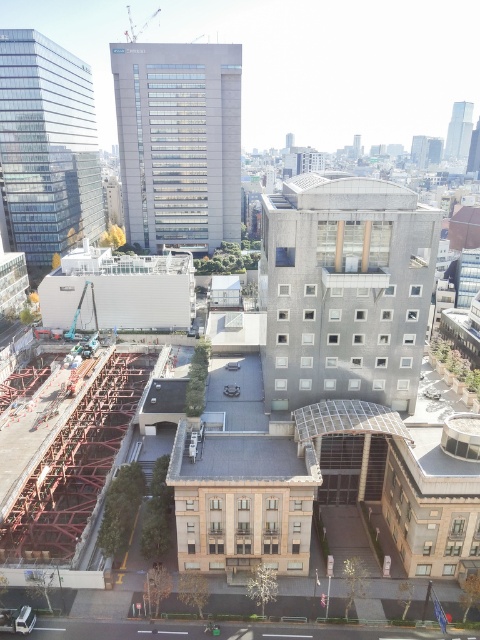
Question: Can you confirm if slate gray concrete building at center is positioned to the right of gray concrete building at center?

Choices:
 (A) no
 (B) yes

Answer: (B)

Question: Which point is closer to the camera?

Choices:
 (A) (296, 282)
 (B) (216, 145)

Answer: (A)

Question: Which object is farther from the camera taking this photo?

Choices:
 (A) slate gray concrete building at center
 (B) gray concrete building at center

Answer: (B)

Question: Which point appears farthest from the camera in this image?

Choices:
 (A) (380, 348)
 (B) (223, 170)

Answer: (B)

Question: Is slate gray concrete building at center positioned before gray concrete building at center?

Choices:
 (A) no
 (B) yes

Answer: (B)

Question: Is slate gray concrete building at center further to the viewer compared to gray concrete building at center?

Choices:
 (A) no
 (B) yes

Answer: (A)